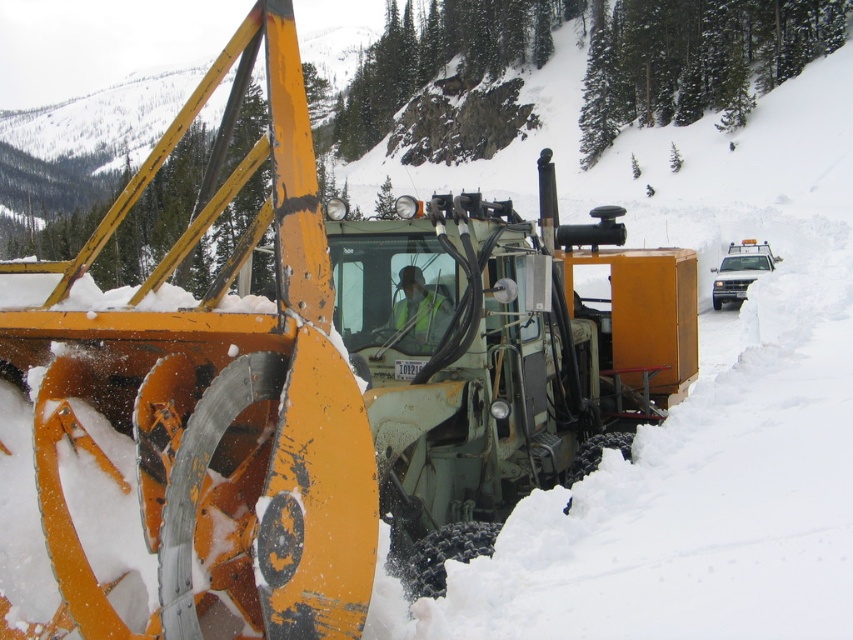
Question: Which of the following is the farthest from the observer?

Choices:
 (A) reflective yellow safety vest at center
 (B) matte yellow snowplow at center

Answer: (B)

Question: Which of the following is the farthest from the observer?

Choices:
 (A) (431, 291)
 (B) (741, 264)

Answer: (B)

Question: Is reflective yellow safety vest at center smaller than matte yellow snowplow at center?

Choices:
 (A) yes
 (B) no

Answer: (A)

Question: Can you confirm if reflective yellow safety vest at center is smaller than matte yellow snowplow at center?

Choices:
 (A) no
 (B) yes

Answer: (B)

Question: Is reflective yellow safety vest at center in front of matte yellow snowplow at center?

Choices:
 (A) no
 (B) yes

Answer: (B)